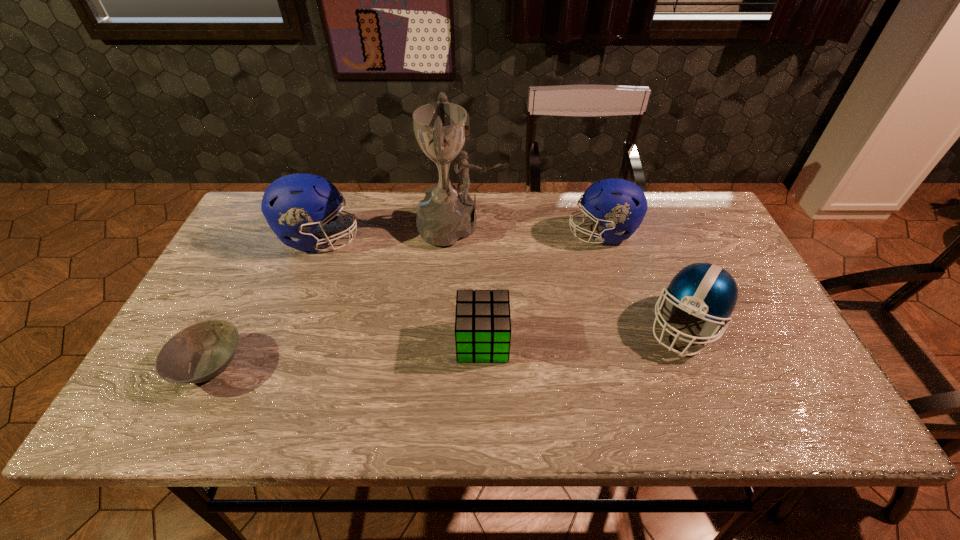
At what (x,y) coordinates should I click in order to perform the action: click on the tallest object. Please return your answer as a coordinate pair (x, y). Looking at the image, I should click on (447, 213).

Image resolution: width=960 pixels, height=540 pixels. Find the location of `the leftmost football helmet`. the leftmost football helmet is located at coordinates (294, 205).

Identify the location of the nearest football helmet. (705, 290).

At what (x,y) coordinates should I click in order to perform the action: click on cube. Please return your answer as a coordinate pair (x, y). The height and width of the screenshot is (540, 960). Looking at the image, I should click on (482, 319).

The height and width of the screenshot is (540, 960). Find the location of `bowl`. bowl is located at coordinates (202, 351).

Where is `blank space located 0.340m on the side with emblem of the award`? The width and height of the screenshot is (960, 540). blank space located 0.340m on the side with emblem of the award is located at coordinates (613, 226).

This screenshot has height=540, width=960. What are the coordinates of `vacant space positioned on the front-facing side of the leftmost football helmet` in the screenshot? It's located at (442, 238).

Image resolution: width=960 pixels, height=540 pixels. Identify the location of free space located 0.100m at the front of the nearest football helmet with the faceguard. (716, 402).

The image size is (960, 540). I want to click on vacant region located 0.270m on the left of the fifth tallest object, so click(x=344, y=342).

The height and width of the screenshot is (540, 960). I want to click on free location located on the right of the bowl, so click(281, 364).